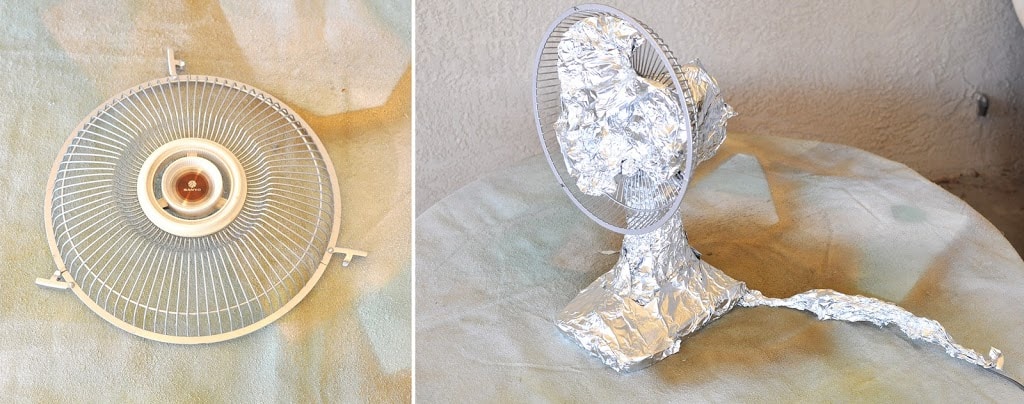
Where is `top of fan`? This screenshot has width=1024, height=404. top of fan is located at coordinates (181, 255).